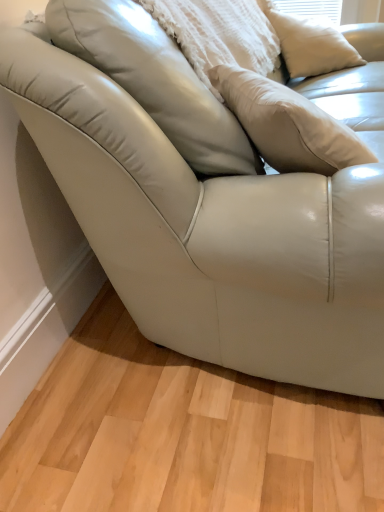
In order to face matte white pillow at upper center, positioned as the 2th pillow in right-to-left order, should I rotate leftwards or rightwards?

To face it directly, rotate right by 1.046 degrees.

Locate an element on the screen. matte white pillow at upper center, the 1th pillow from the left is located at coordinates (155, 81).

This screenshot has height=512, width=384. Describe the element at coordinates (155, 81) in the screenshot. I see `matte white pillow at upper center, the 1th pillow from the left` at that location.

The height and width of the screenshot is (512, 384). What do you see at coordinates (310, 42) in the screenshot?
I see `white matte pillow at upper right, the first pillow from the right` at bounding box center [310, 42].

Image resolution: width=384 pixels, height=512 pixels. In order to click on white matte pillow at upper right, the first pillow from the right in this screenshot , I will do [x=310, y=42].

Identify the location of matte white pillow at upper center, the 1th pillow from the left. The height and width of the screenshot is (512, 384). pyautogui.click(x=155, y=81).

Consider the image. Which object is positioned more to the right, matte white pillow at upper center, positioned as the 2th pillow in right-to-left order, or white matte pillow at upper right, the first pillow from the right?

white matte pillow at upper right, the first pillow from the right, is more to the right.

Is matte white pillow at upper center, the 1th pillow from the left, positioned in front of white matte pillow at upper right, the first pillow from the right?

Yes, matte white pillow at upper center, the 1th pillow from the left, is closer to the camera.

Which is nearer, (252,146) or (327,18)?

Clearly, point (252,146) is closer to the camera than point (327,18).

From the image's perspective, which object appears higher, matte white pillow at upper center, the 1th pillow from the left, or white matte pillow at upper right, the second pillow in the left-to-right sequence?

white matte pillow at upper right, the second pillow in the left-to-right sequence, appears higher in the image.

From a real-world perspective, between matte white pillow at upper center, the 1th pillow from the left, and white matte pillow at upper right, the first pillow from the right, who is vertically lower?

white matte pillow at upper right, the first pillow from the right.

Which object is wider, matte white pillow at upper center, the 1th pillow from the left, or white matte pillow at upper right, the first pillow from the right?

matte white pillow at upper center, the 1th pillow from the left.

Considering the relative sizes of matte white pillow at upper center, positioned as the 2th pillow in right-to-left order, and white matte pillow at upper right, the first pillow from the right, in the image provided, is matte white pillow at upper center, positioned as the 2th pillow in right-to-left order, shorter than white matte pillow at upper right, the first pillow from the right,?

Indeed, matte white pillow at upper center, positioned as the 2th pillow in right-to-left order, has a lesser height compared to white matte pillow at upper right, the first pillow from the right.

Considering the sizes of objects matte white pillow at upper center, the 1th pillow from the left, and white matte pillow at upper right, the first pillow from the right, in the image provided, who is smaller, matte white pillow at upper center, the 1th pillow from the left, or white matte pillow at upper right, the first pillow from the right,?

Smaller between the two is white matte pillow at upper right, the first pillow from the right.

Choose the correct answer: Is matte white pillow at upper center, the 1th pillow from the left, inside white matte pillow at upper right, the first pillow from the right, or outside it?

The correct answer is: outside.

Is matte white pillow at upper center, positioned as the 2th pillow in right-to-left order, not close to white matte pillow at upper right, the first pillow from the right?

Yes, matte white pillow at upper center, positioned as the 2th pillow in right-to-left order, and white matte pillow at upper right, the first pillow from the right, are quite far apart.

Is matte white pillow at upper center, positioned as the 2th pillow in right-to-left order, facing towards white matte pillow at upper right, the second pillow in the left-to-right sequence?

Yes, matte white pillow at upper center, positioned as the 2th pillow in right-to-left order, is turned towards white matte pillow at upper right, the second pillow in the left-to-right sequence.

Locate an element on the screen. Image resolution: width=384 pixels, height=512 pixels. pillow behind the matte white pillow at upper center, the 1th pillow from the left is located at coordinates (310, 42).

Between white matte pillow at upper right, the first pillow from the right, and matte white pillow at upper center, positioned as the 2th pillow in right-to-left order, which one appears on the left side from the viewer's perspective?

matte white pillow at upper center, positioned as the 2th pillow in right-to-left order, is more to the left.

Who is more distant, white matte pillow at upper right, the second pillow in the left-to-right sequence, or matte white pillow at upper center, the 1th pillow from the left?

white matte pillow at upper right, the second pillow in the left-to-right sequence.

Is point (266, 15) closer or farther from the camera than point (191, 121)?

Clearly, point (266, 15) is more distant from the camera than point (191, 121).

From the image's perspective, is white matte pillow at upper right, the second pillow in the left-to-right sequence, located above or below matte white pillow at upper center, positioned as the 2th pillow in right-to-left order?

white matte pillow at upper right, the second pillow in the left-to-right sequence, is situated higher than matte white pillow at upper center, positioned as the 2th pillow in right-to-left order, in the image.

From a real-world perspective, between white matte pillow at upper right, the second pillow in the left-to-right sequence, and matte white pillow at upper center, positioned as the 2th pillow in right-to-left order, who is vertically higher?

In real-world perspective, matte white pillow at upper center, positioned as the 2th pillow in right-to-left order, is above.

Considering the sizes of objects white matte pillow at upper right, the first pillow from the right, and matte white pillow at upper center, positioned as the 2th pillow in right-to-left order, in the image provided, who is thinner, white matte pillow at upper right, the first pillow from the right, or matte white pillow at upper center, positioned as the 2th pillow in right-to-left order,?

Thinner between the two is white matte pillow at upper right, the first pillow from the right.

Does white matte pillow at upper right, the second pillow in the left-to-right sequence, have a lesser height compared to matte white pillow at upper center, positioned as the 2th pillow in right-to-left order?

No, white matte pillow at upper right, the second pillow in the left-to-right sequence, is not shorter than matte white pillow at upper center, positioned as the 2th pillow in right-to-left order.

From the picture: Between white matte pillow at upper right, the first pillow from the right, and matte white pillow at upper center, the 1th pillow from the left, which one has larger size?

Bigger between the two is matte white pillow at upper center, the 1th pillow from the left.

Is white matte pillow at upper right, the second pillow in the left-to-right sequence, surrounding matte white pillow at upper center, the 1th pillow from the left?

No, matte white pillow at upper center, the 1th pillow from the left, is not a part of white matte pillow at upper right, the second pillow in the left-to-right sequence.

From the picture: Is the surface of white matte pillow at upper right, the second pillow in the left-to-right sequence, in direct contact with matte white pillow at upper center, the 1th pillow from the left?

white matte pillow at upper right, the second pillow in the left-to-right sequence, and matte white pillow at upper center, the 1th pillow from the left, are not in contact.

Is white matte pillow at upper right, the second pillow in the left-to-right sequence, oriented away from matte white pillow at upper center, positioned as the 2th pillow in right-to-left order?

That's not correct — white matte pillow at upper right, the second pillow in the left-to-right sequence, is not looking away from matte white pillow at upper center, positioned as the 2th pillow in right-to-left order.

How much distance is there between white matte pillow at upper right, the second pillow in the left-to-right sequence, and matte white pillow at upper center, the 1th pillow from the left?

white matte pillow at upper right, the second pillow in the left-to-right sequence, is 4.18 feet away from matte white pillow at upper center, the 1th pillow from the left.

At what (x,y) coordinates should I click in order to perform the action: click on pillow to the left of white matte pillow at upper right, the first pillow from the right. Please return your answer as a coordinate pair (x, y). Looking at the image, I should click on (155, 81).

You are a GUI agent. You are given a task and a screenshot of the screen. Output one action in this format:
    pyautogui.click(x=<x>, y=<y>)
    Task: Click on the pillow in front of the white matte pillow at upper right, the second pillow in the left-to-right sequence
    The image size is (384, 512).
    Given the screenshot: What is the action you would take?
    pyautogui.click(x=155, y=81)

Identify the location of pillow behind the matte white pillow at upper center, the 1th pillow from the left. The image size is (384, 512). (310, 42).